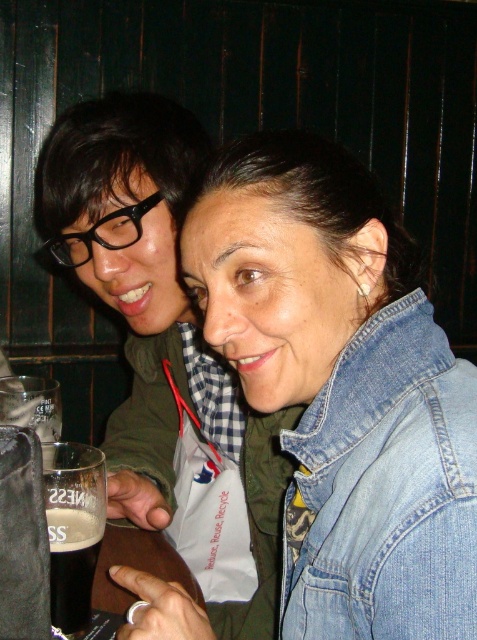
The image size is (477, 640). Describe the element at coordinates (384, 490) in the screenshot. I see `denim jacket at lower right` at that location.

Does denim jacket at lower right appear on the right side of dark brown glass at lower left?

Yes, denim jacket at lower right is to the right of dark brown glass at lower left.

Which is behind, point (334, 364) or point (100, 509)?

The point (100, 509) is behind.

Image resolution: width=477 pixels, height=640 pixels. What are the coordinates of `denim jacket at lower right` in the screenshot? It's located at (384, 490).